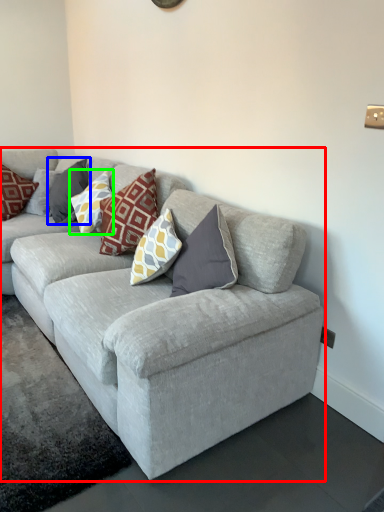
Question: Which is nearer to the studio couch (highlighted by a red box)? pillow (highlighted by a blue box) or pillow (highlighted by a green box).

Choices:
 (A) pillow
 (B) pillow

Answer: (B)